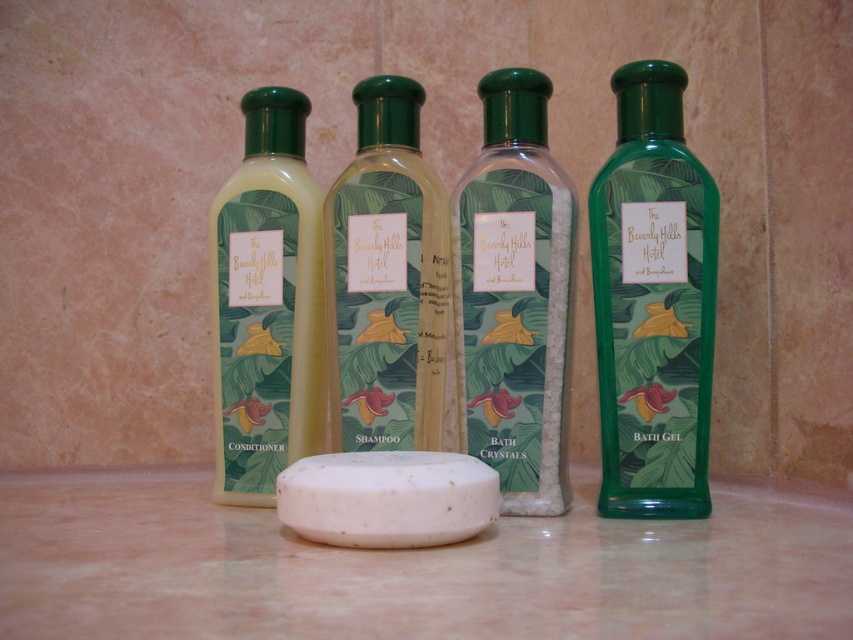
You are a guest at The Beverly Hills Hotel and want to use the green matte bath gel at right and the green matte shampoo at center. Which one should you grab first if you want to reach the one closer to you?

The green matte bath gel at right is in front of the green matte shampoo at center, so it is closer to you. Grab the green matte bath gel at right first.

You are organizing a spa day and need to place the green matte bath gel at right and the matte green plastic conditioner at left on a shelf. Which one should you place first to ensure proper positioning according to their arrangement in the image?

The green matte bath gel at right should be placed first because it is closer to the viewer than the matte green plastic conditioner at left, so it needs to be positioned in front to maintain the correct spatial relationship.

You are a hotel guest who wants to choose between the green matte shampoo at center and the white matte soap at center for your shower. Which item is narrower in width?

The green matte shampoo at center is thinner than the white matte soap at center, so it is narrower in width.